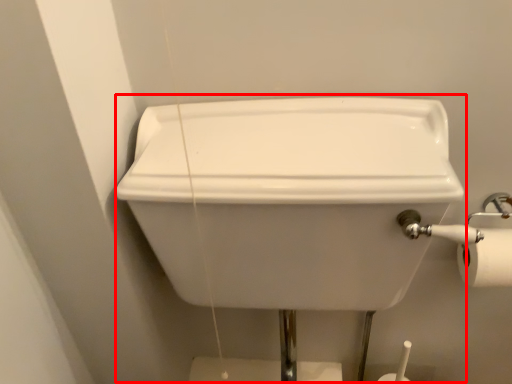
Question: From the image's perspective, where is sink (annotated by the red box) located in relation to toilet paper in the image?

Choices:
 (A) below
 (B) above

Answer: (A)